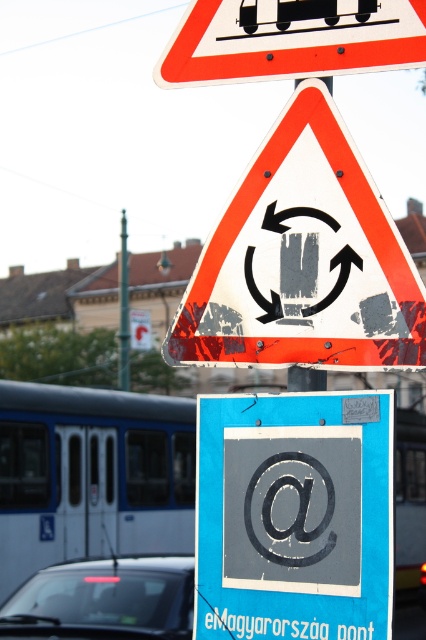
Between orange reflective triangle at upper center and metallic pole at center, which one has more height?

metallic pole at center is taller.

Between point (252, 68) and point (127, 272), which one is positioned behind?

The point (127, 272) is more distant.

What are the coordinates of `orange reflective triangle at upper center` in the screenshot? It's located at (290, 38).

Who is positioned more to the left, white plastic triangle at center or black glass car at lower left?

From the viewer's perspective, black glass car at lower left appears more on the left side.

The image size is (426, 640). What are the coordinates of `white plastic triangle at center` in the screenshot? It's located at (304, 260).

Can you confirm if white plastic triangle at center is shorter than white metallic bus at lower left?

Yes.

Is point (198, 352) less distant than point (138, 513)?

Yes.

The width and height of the screenshot is (426, 640). Identify the location of white plastic triangle at center. (304, 260).